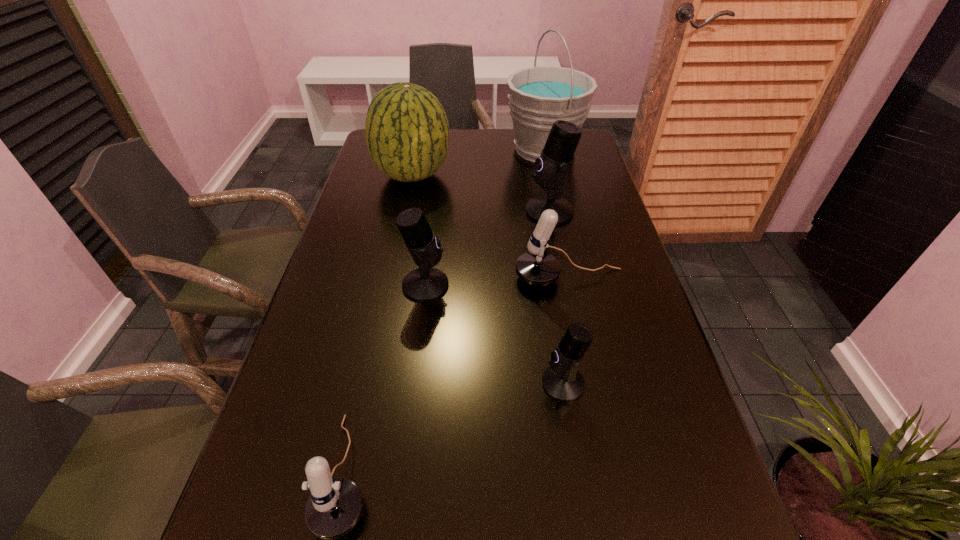
Find the location of `the second closest black microphone to the right white microphone`. the second closest black microphone to the right white microphone is located at coordinates (424, 284).

The width and height of the screenshot is (960, 540). What are the coordinates of `the second closest white microphone to the watermelon` in the screenshot? It's located at (334, 507).

You are a GUI agent. You are given a task and a screenshot of the screen. Output one action in this format:
    pyautogui.click(x=<x>, y=<y>)
    Task: Click on the free space that satisfies the following two spatial constraints: 1. on the back side of the green watermelon; 2. on the right side of the blue bucket
    
    Given the screenshot: What is the action you would take?
    pyautogui.click(x=418, y=150)